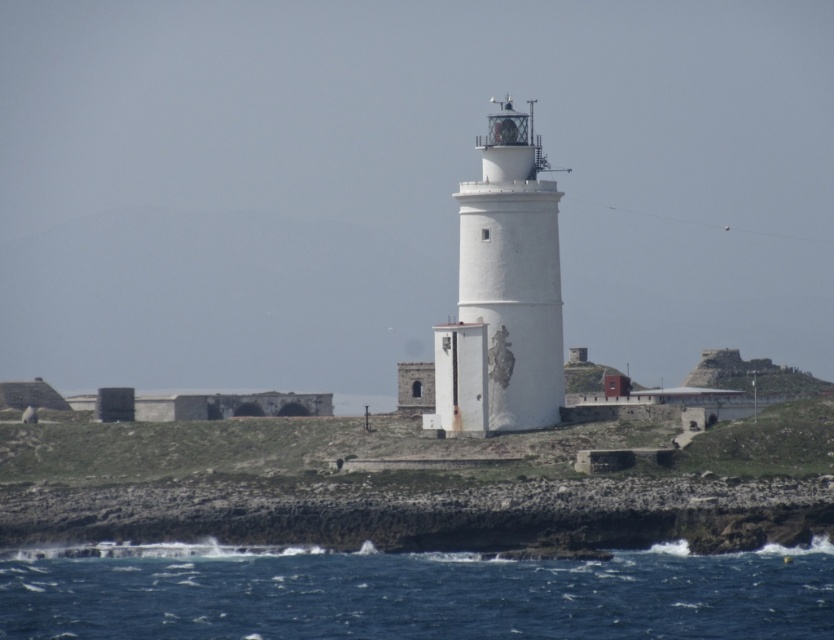
Does blue water at lower left appear on the left side of white smooth lighthouse at center?

Yes, blue water at lower left is to the left of white smooth lighthouse at center.

The width and height of the screenshot is (834, 640). Identify the location of blue water at lower left. (410, 593).

Locate an element on the screen. The height and width of the screenshot is (640, 834). blue water at lower left is located at coordinates (410, 593).

Locate an element on the screen. The width and height of the screenshot is (834, 640). blue water at lower left is located at coordinates (410, 593).